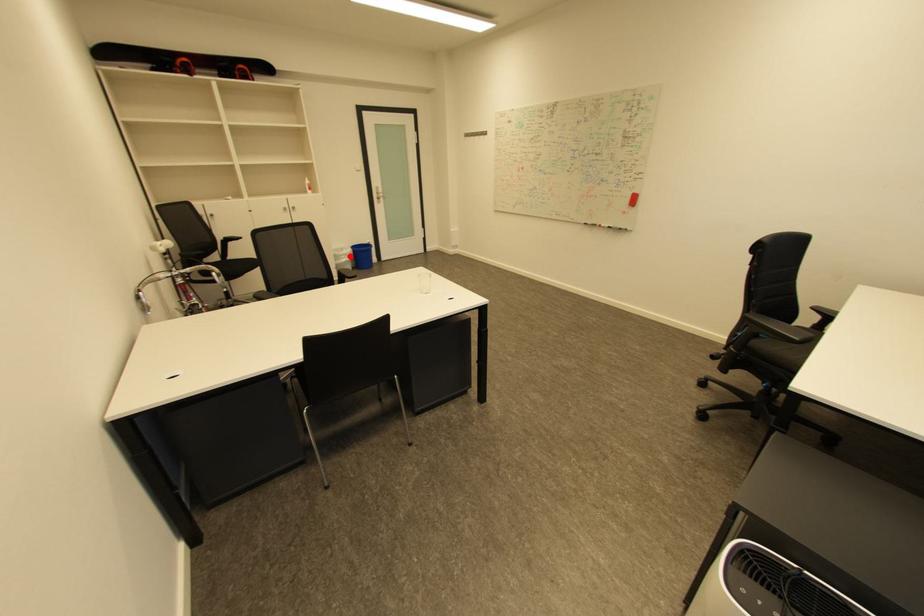
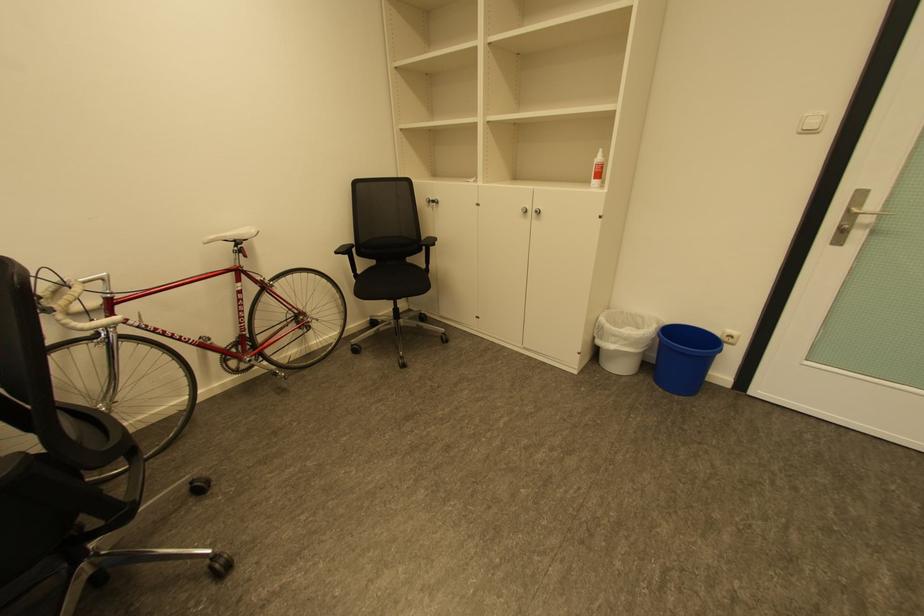
Question: I am providing you with two images of the same scene from different viewpoints. A red point is shown in image1. For the corresponding object point in image2, is it positioned nearer or farther from the camera?

Choices:
 (A) Nearer
 (B) Farther

Answer: (B)